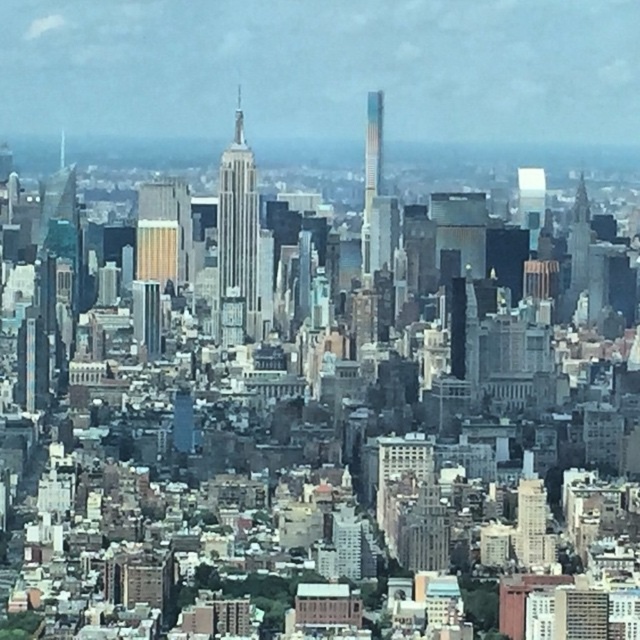
Question: Which point appears closest to the camera in this image?

Choices:
 (A) (371, 218)
 (B) (221, 253)

Answer: (B)

Question: Does white glass skyscraper at center appear on the right side of multicolored glass skyscraper at center?

Choices:
 (A) no
 (B) yes

Answer: (A)

Question: Does white glass skyscraper at center appear under multicolored glass skyscraper at center?

Choices:
 (A) yes
 (B) no

Answer: (A)

Question: Which object is farther from the camera taking this photo?

Choices:
 (A) white glass skyscraper at center
 (B) multicolored glass skyscraper at center

Answer: (B)

Question: Is white glass skyscraper at center thinner than multicolored glass skyscraper at center?

Choices:
 (A) no
 (B) yes

Answer: (A)